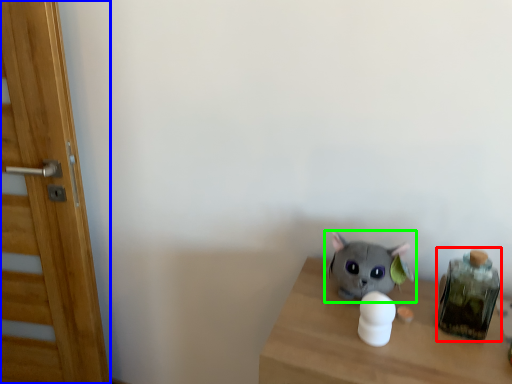
Question: Based on their relative distances, which object is farther from glass jar (highlighted by a red box)? Choose from door (highlighted by a blue box) and toy (highlighted by a green box).

Choices:
 (A) door
 (B) toy

Answer: (A)